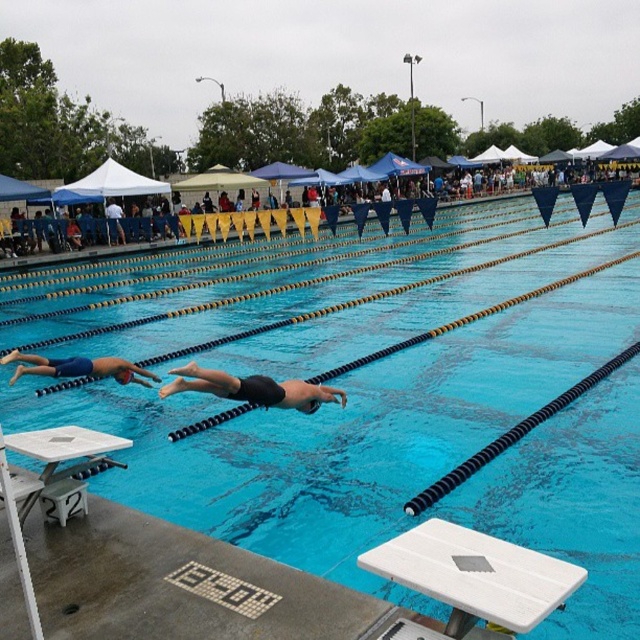
Locate an element on the screen. The height and width of the screenshot is (640, 640). blue rubber lane dividers at center is located at coordinates (342, 429).

Is blue rubber lane dividers at center wider than blue matte swimmer at left?

Yes.

Is point (240, 477) positioned before point (81, 356)?

Yes, it is in front of point (81, 356).

Find the location of `blue rubber lane dividers at center`. blue rubber lane dividers at center is located at coordinates (342, 429).

In the scene shown: Does smooth black swimmer at center appear over blue matte swimmer at left?

Yes.

Who is lower down, smooth black swimmer at center or blue matte swimmer at left?

Positioned lower is blue matte swimmer at left.

The image size is (640, 640). I want to click on smooth black swimmer at center, so click(248, 225).

Where is `smooth black swimmer at center`? The height and width of the screenshot is (640, 640). smooth black swimmer at center is located at coordinates (248, 225).

Is blue rubber lane dividers at center smaller than white plastic diving board at lower center?

Incorrect, blue rubber lane dividers at center is not smaller in size than white plastic diving board at lower center.

Image resolution: width=640 pixels, height=640 pixels. What do you see at coordinates (342, 429) in the screenshot?
I see `blue rubber lane dividers at center` at bounding box center [342, 429].

Identify the location of blue rubber lane dividers at center. The width and height of the screenshot is (640, 640). tap(342, 429).